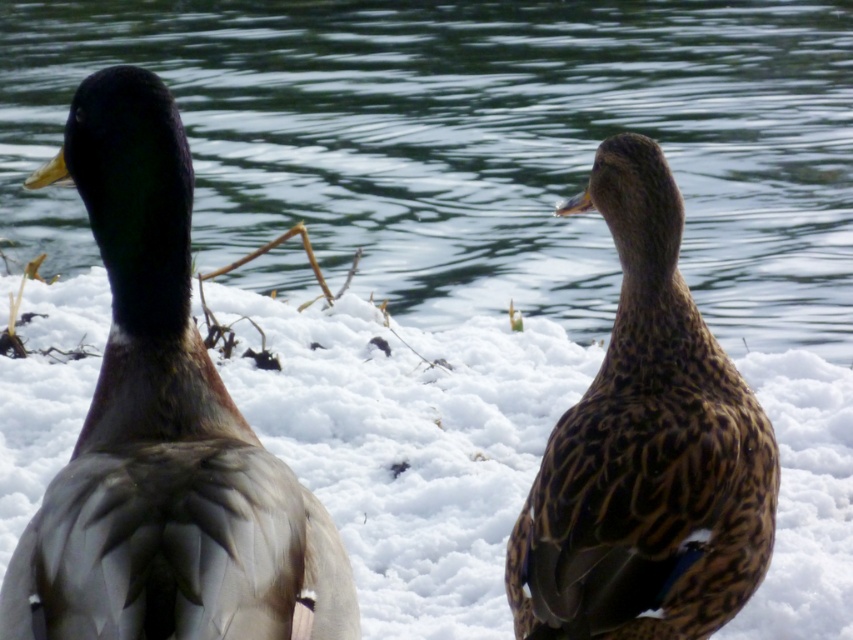
You are standing in the snowy area and want to reach the glossy water at center without getting your feet wet. Which direction should you move relative to the brown speckled feathers at center?

You should move to the left of the brown speckled feathers at center because the glossy water at center is located to the left of it.

You are a birdwatcher observing the two ducks in the scene. You notice that the glossy water at center and the brown speckled feathers at center are both in the central area. Which one is closer to you?

The glossy water at center is positioned over brown speckled feathers at center, meaning the glossy water at center is closer to you.

You are a birdwatcher observing two ducks on a snowy area. You see a point at (686, 128) and another at (485, 531). Which point is closer to you?

The point at (485, 531) is closer to you because the point at (686, 128) is behind it.